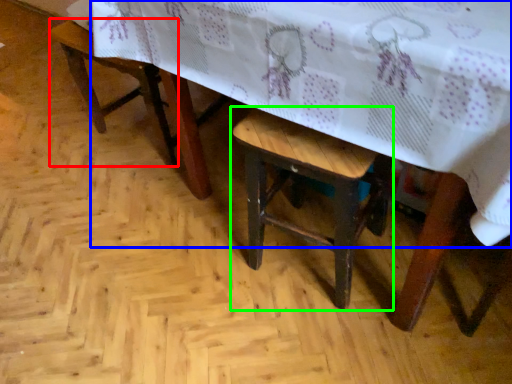
Question: Estimate the real-world distances between objects in this image. Which object is farther from armchair (highlighted by a red box), table (highlighted by a blue box) or stool (highlighted by a green box)?

Choices:
 (A) table
 (B) stool

Answer: (B)